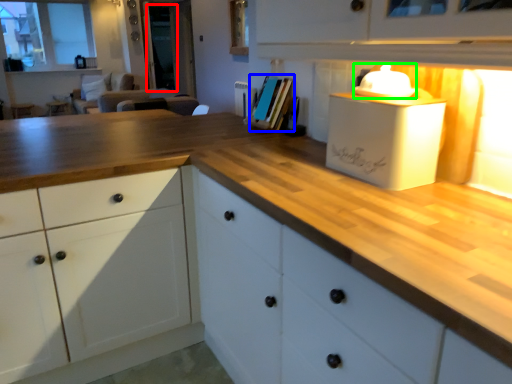
Question: Which object is the farthest from glass door (highlighted by a red box)? Choose among these: book (highlighted by a blue box) or appliance (highlighted by a green box).

Choices:
 (A) book
 (B) appliance

Answer: (B)